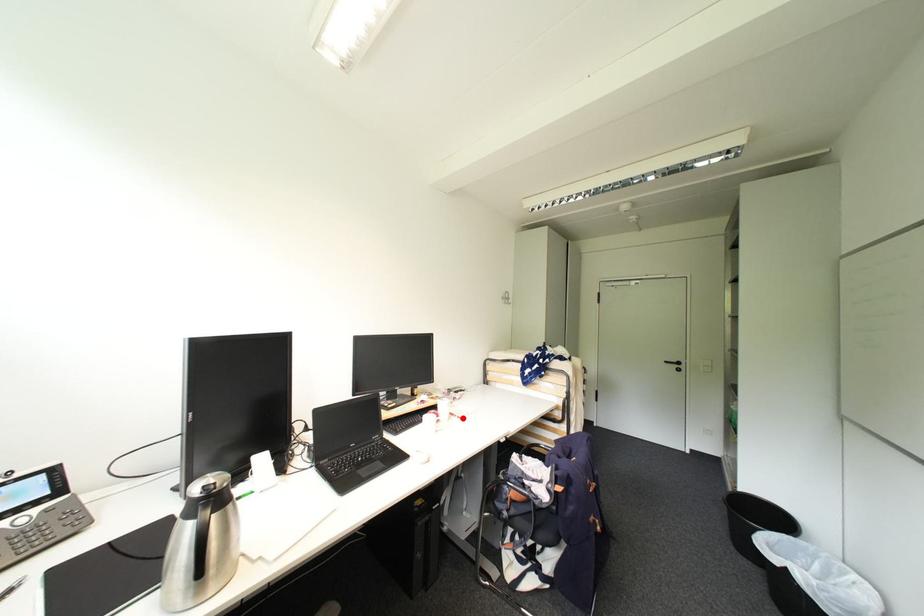
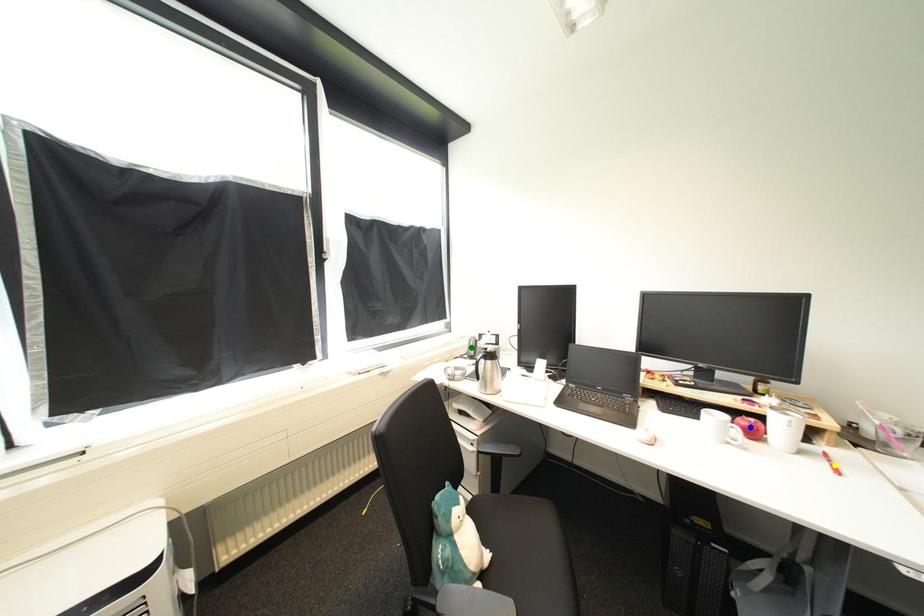
Question: I am providing you with two images of the same scene from different viewpoints. A red point is marked on the first image. You are given multiple points on the second image. Which point in image 2 is actually the same real-world point as the red point in image 1?

Choices:
 (A) blue point
 (B) yellow point
 (C) green point

Answer: (B)